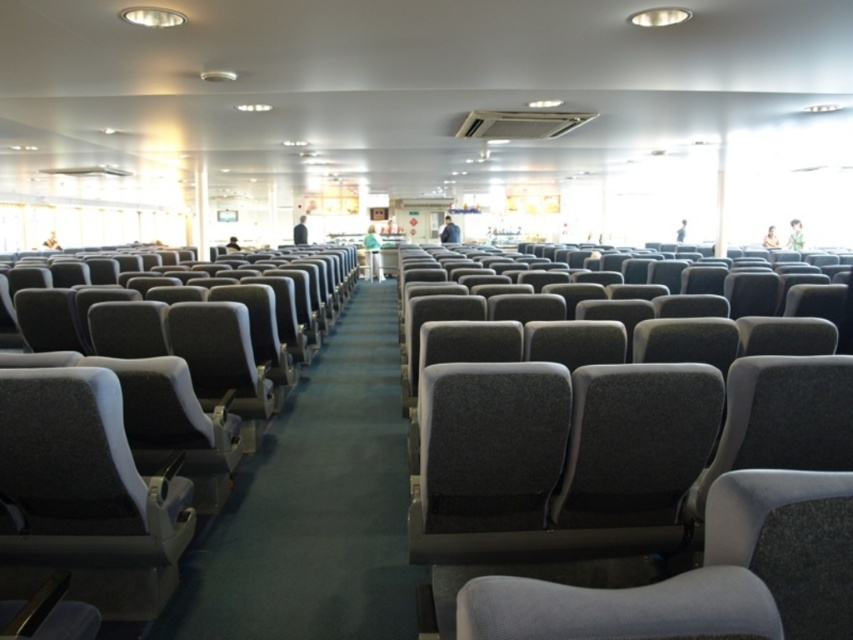
You are standing in the ferry cabin and want to move from one point to another. You have to go from point A to point B. The points are labeled as point A at coordinates point A is point (579, 618) and point B is point (271, 289). If you look at the ceiling, which point is closer to you?

Point A at coordinates point (579, 618) is closer to the camera than point B at coordinates point (271, 289).

You need to sit down in the seating area and have a preference for wider seats. Which seat should you choose between the gray fabric seat at center and the gray fabric seat at left?

The gray fabric seat at center has a larger width than the gray fabric seat at left, so you should choose the gray fabric seat at center.

You are sitting in the gray fabric seat at center and want to move to the gray fabric seat at left. Which direction should you walk to get closer to your destination?

The gray fabric seat at left is further away from the viewer than the gray fabric seat at center, so you should walk towards the gray fabric seat at left to get closer to your destination.